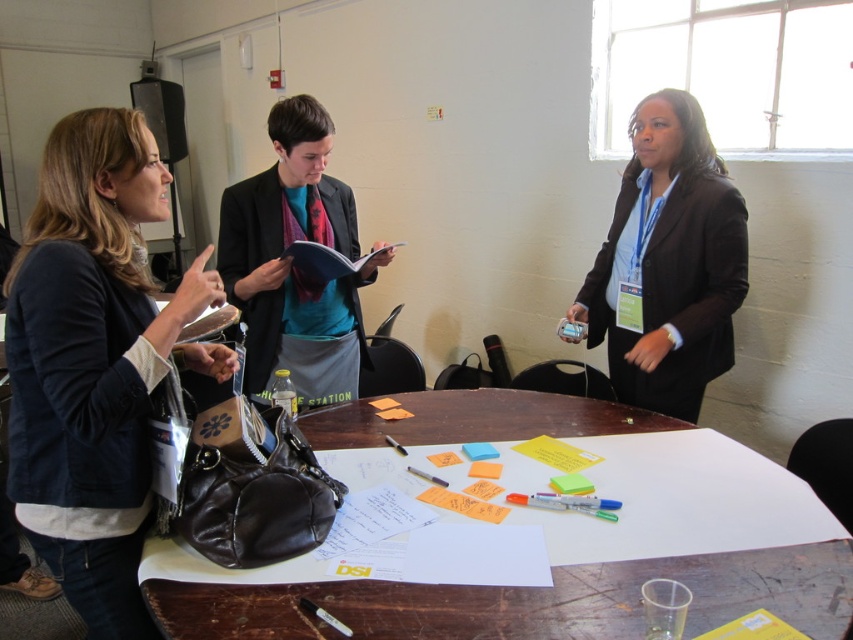
Who is taller, dark blue leather jacket at left or black matte blazer at center?

dark blue leather jacket at left is taller.

Does point (112, 148) lie in front of point (621, 205)?

Yes, it is.

Locate an element on the screen. The image size is (853, 640). dark blue leather jacket at left is located at coordinates (96, 362).

Describe the element at coordinates (520, 600) in the screenshot. This screenshot has height=640, width=853. I see `brown leather table at center` at that location.

Is point (238, 596) less distant than point (646, 189)?

Yes, it is in front of point (646, 189).

Locate an element on the screen. The image size is (853, 640). brown leather table at center is located at coordinates (520, 600).

Between point (51, 364) and point (688, 563), which one is positioned in front?

Point (51, 364)

Describe the element at coordinates (96, 362) in the screenshot. I see `dark blue leather jacket at left` at that location.

Is point (88, 337) farther from camera compared to point (766, 552)?

No, it is not.

Locate an element on the screen. The height and width of the screenshot is (640, 853). dark blue leather jacket at left is located at coordinates (96, 362).